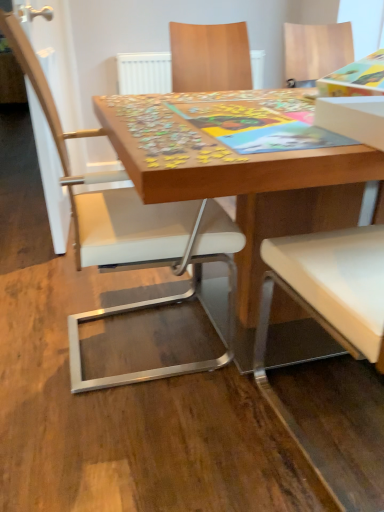
I want to click on vacant area that is in front of white leather chair at center, so click(x=117, y=455).